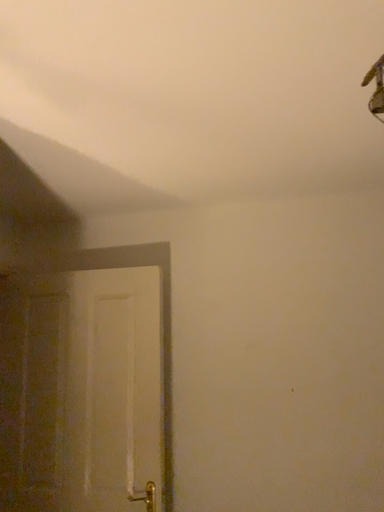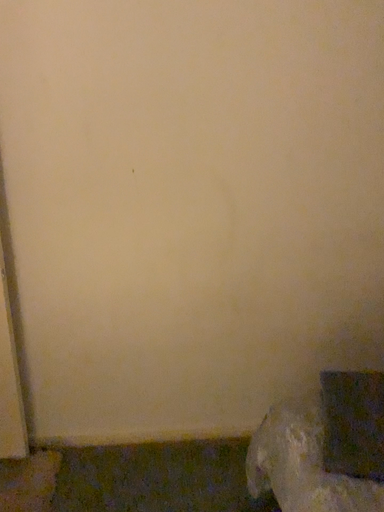
Question: Which way did the camera rotate in the video?

Choices:
 (A) rotated left
 (B) rotated right

Answer: (B)